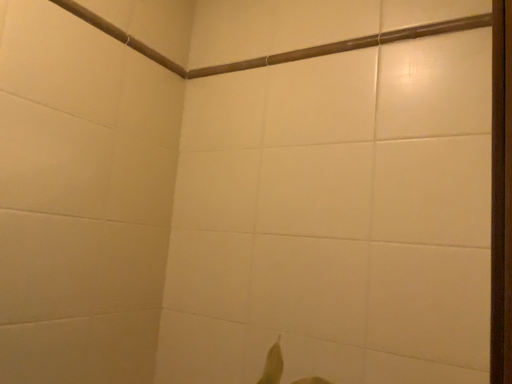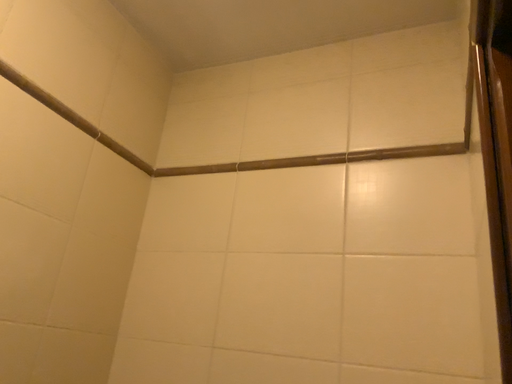
Question: How did the camera likely rotate when shooting the video?

Choices:
 (A) rotated left
 (B) rotated right

Answer: (B)